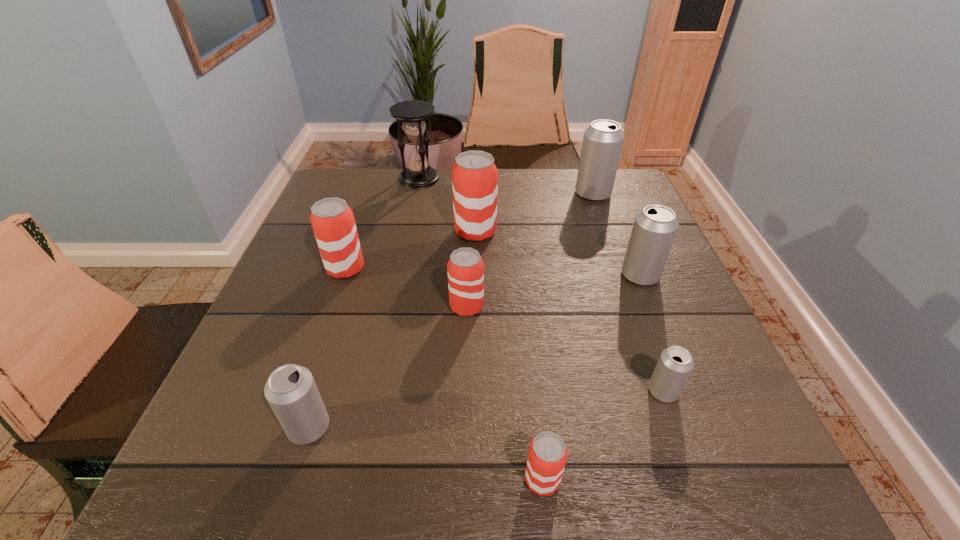
At what (x,y) coordinates should I click in order to perform the action: click on free region located on the back of the third nearest orange beer can. Please return your answer as a coordinate pair (x, y). The height and width of the screenshot is (540, 960). Looking at the image, I should click on (368, 203).

Where is `vacant space situated on the back of the second biggest white beer can`? The image size is (960, 540). vacant space situated on the back of the second biggest white beer can is located at coordinates (615, 214).

Locate an element on the screen. Image resolution: width=960 pixels, height=540 pixels. free point located 0.310m on the left of the third farthest orange beer can is located at coordinates (300, 306).

I want to click on free space located on the back of the leftmost white beer can, so click(x=356, y=276).

The image size is (960, 540). In order to click on vacant space situated 0.080m on the back of the seventh farthest object in this screenshot , I will do `click(646, 343)`.

This screenshot has height=540, width=960. In order to click on blank area located on the right of the nearest object in this screenshot , I will do `click(690, 480)`.

At what (x,y) coordinates should I click in order to perform the action: click on hourglass that is positioned at the far edge. Please return your answer as a coordinate pair (x, y). This screenshot has width=960, height=540. Looking at the image, I should click on (418, 175).

Find the location of `beer can present at the far edge`. beer can present at the far edge is located at coordinates (602, 143).

Locate an element on the screen. object located in the near left corner section of the desktop is located at coordinates (290, 390).

Identify the location of object located at the far right corner. The image size is (960, 540). (602, 143).